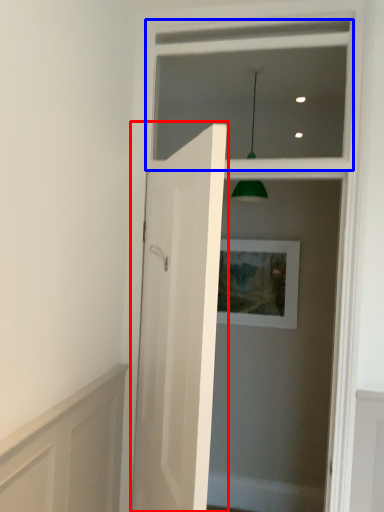
Question: Among these objects, which one is farthest to the camera, door (highlighted by a red box) or window frame (highlighted by a blue box)?

Choices:
 (A) door
 (B) window frame

Answer: (B)